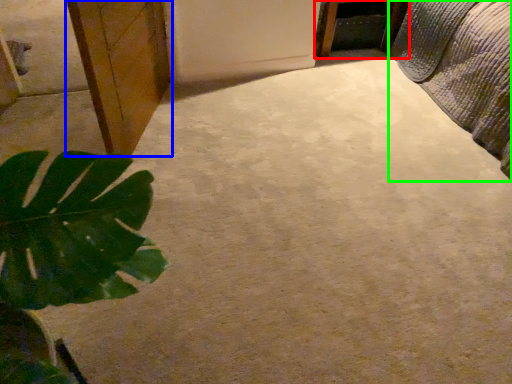
Question: Estimate the real-world distances between objects in this image. Which object is farther from furniture (highlighted by a red box), cabinetry (highlighted by a blue box) or bed (highlighted by a green box)?

Choices:
 (A) cabinetry
 (B) bed

Answer: (A)